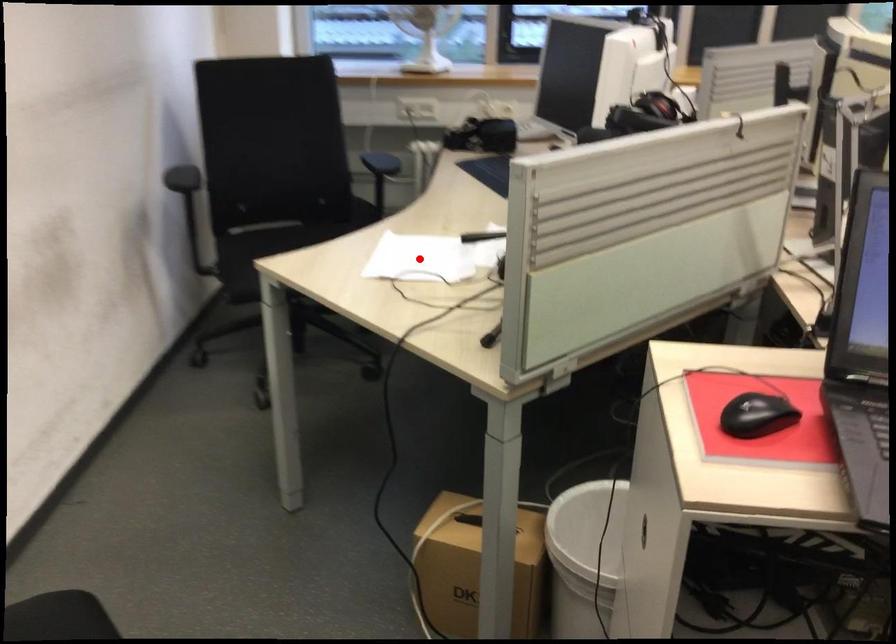
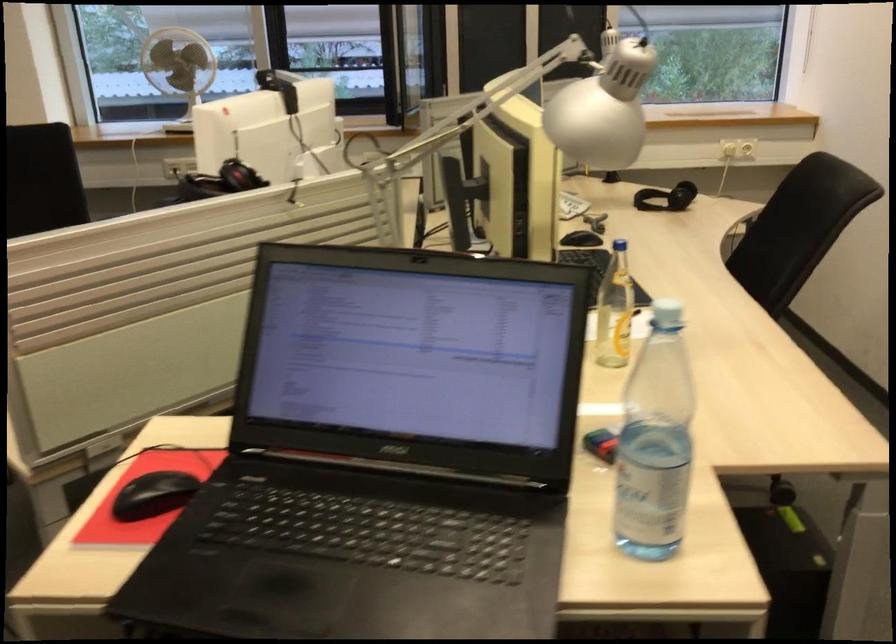
Question: I am providing you with two images of the same scene from different viewpoints. A red point is marked on the first image. At the location where the point appears in image 1, is it still visible in image 2?

Choices:
 (A) Yes
 (B) No

Answer: (B)